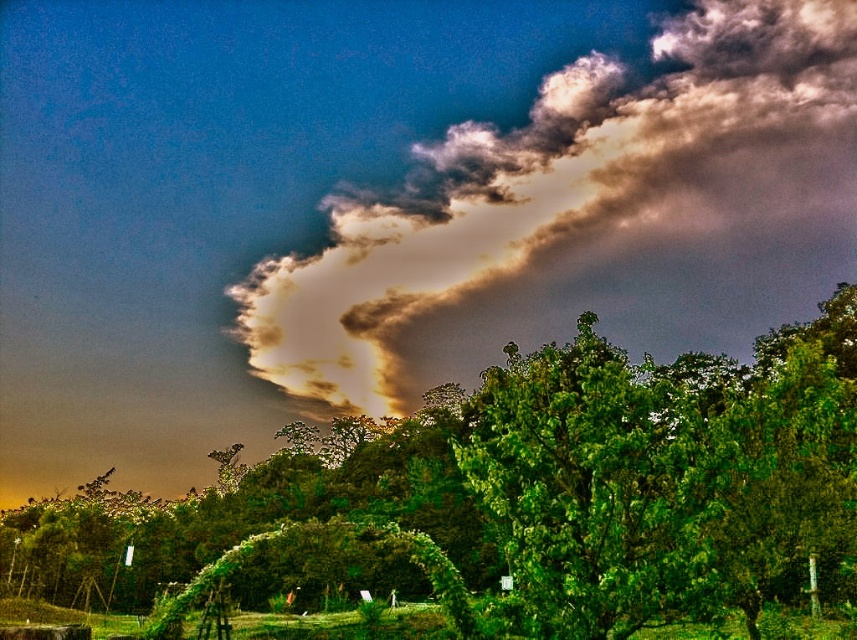
You are an artist trying to paint the scene. You need to decide which object to paint first based on their sizes. Which one should you start with, the green leafy tree at center or the cloudy textured sky at upper center?

The green leafy tree at center is bigger than the cloudy textured sky at upper center, so you should start painting the green leafy tree at center first to ensure proper scaling and positioning before moving on to smaller elements.

You are observing the sky scene and want to determine which of the two points, point (421, 508) or point (552, 264), is nearer to your viewpoint. Based on the description, which point is closer?

Point (421, 508) is closer to the camera than point (552, 264).